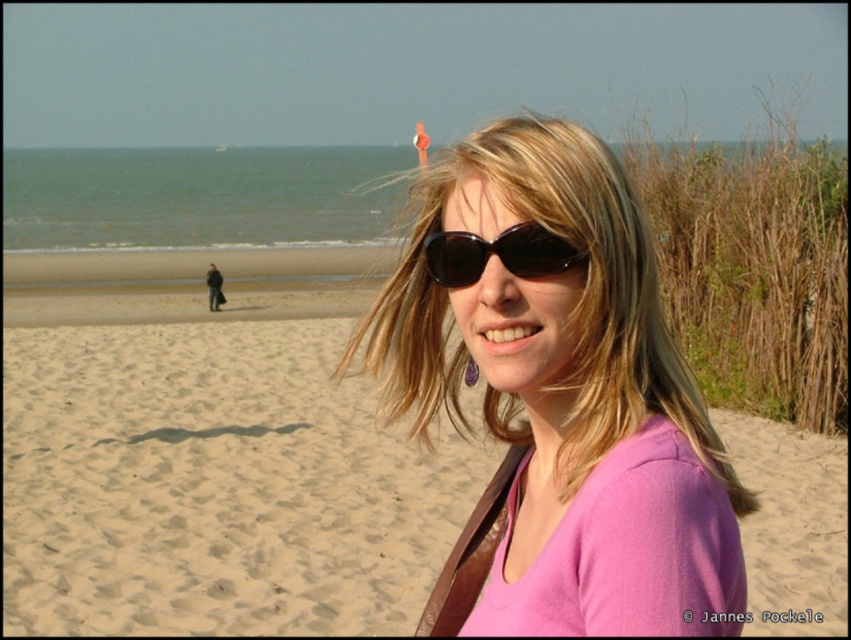
Which of these two, sandy beach at center or black matte sunglasses at center, stands shorter?

Standing shorter between the two is black matte sunglasses at center.

Image resolution: width=851 pixels, height=640 pixels. What do you see at coordinates (214, 484) in the screenshot? I see `sandy beach at center` at bounding box center [214, 484].

Between point (789, 504) and point (524, 269), which one is positioned in front?

Point (524, 269)

At what (x,y) coordinates should I click in order to perform the action: click on sandy beach at center. Please return your answer as a coordinate pair (x, y). Image resolution: width=851 pixels, height=640 pixels. Looking at the image, I should click on [214, 484].

Which is above, sandy beach at center or pink matte shirt at center?

pink matte shirt at center

Can you confirm if sandy beach at center is positioned to the left of pink matte shirt at center?

Correct, you'll find sandy beach at center to the left of pink matte shirt at center.

The width and height of the screenshot is (851, 640). Find the location of `sandy beach at center`. sandy beach at center is located at coordinates (214, 484).

Locate an element on the screen. The width and height of the screenshot is (851, 640). sandy beach at center is located at coordinates (214, 484).

This screenshot has height=640, width=851. What do you see at coordinates (564, 388) in the screenshot? I see `pink matte shirt at center` at bounding box center [564, 388].

Looking at this image, is pink matte shirt at center closer to camera compared to black matte sunglasses at center?

Yes.

Which is in front, point (543, 586) or point (480, 244)?

Positioned in front is point (543, 586).

You are a GUI agent. You are given a task and a screenshot of the screen. Output one action in this format:
    pyautogui.click(x=<x>, y=<y>)
    Task: Click on the pink matte shirt at center
    
    Given the screenshot: What is the action you would take?
    pyautogui.click(x=564, y=388)